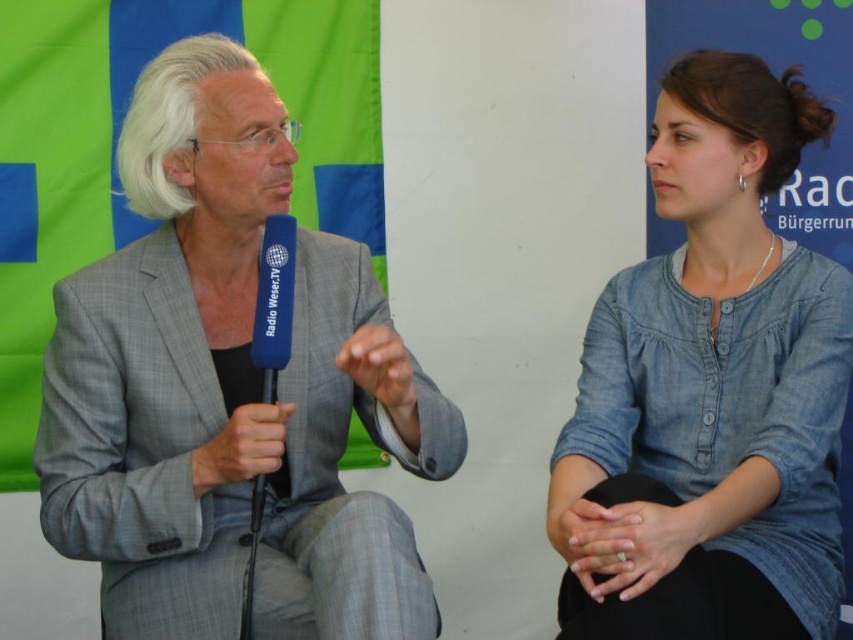
Can you confirm if denim shirt at center is wider than blue foam microphone at left?

Correct, the width of denim shirt at center exceeds that of blue foam microphone at left.

Who is more forward, (643, 461) or (281, 348)?

Point (281, 348) is more forward.

The image size is (853, 640). I want to click on denim shirt at center, so click(711, 390).

The image size is (853, 640). Identify the location of denim shirt at center. (711, 390).

Is gray textured suit at left bigger than denim shirt at center?

Yes.

Does point (247, 260) come in front of point (764, 109)?

No, it is not.

Identify the location of gray textured suit at left. The width and height of the screenshot is (853, 640). (229, 390).

Where is `gray textured suit at left`? This screenshot has height=640, width=853. gray textured suit at left is located at coordinates (229, 390).

Between gray textured suit at left and blue foam microphone at left, which one is positioned lower?

blue foam microphone at left is lower down.

Between point (84, 560) and point (260, 298), which one is positioned behind?

The point (84, 560) is more distant.

Where is `gray textured suit at left`? The height and width of the screenshot is (640, 853). gray textured suit at left is located at coordinates (229, 390).